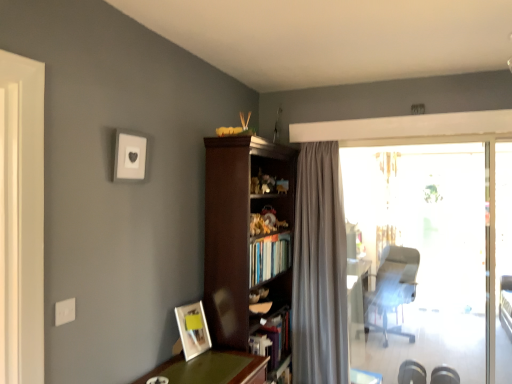
Question: Which is correct: metallic silver chair at right is inside transparent glass door at right, or outside of it?

Choices:
 (A) outside
 (B) inside

Answer: (A)

Question: Is metallic silver chair at right wider or thinner than transparent glass door at right?

Choices:
 (A) thin
 (B) wide

Answer: (B)

Question: Which is nearer to the matte wooden picture frame at lower left, which ranks as the 1th picture frame in right-to-left order?

Choices:
 (A) dark wood bookcase at center
 (B) transparent glass door at right
 (C) hardcover books at center
 (D) metallic silver chair at right
 (E) satin gray curtain at center

Answer: (C)

Question: Which object is positioned closest to the hardcover books at center?

Choices:
 (A) transparent glass door at right
 (B) satin gray curtain at center
 (C) matte wooden picture frame at lower left, the 2th picture frame viewed from the left
 (D) matte gray frame at upper left, the second picture frame viewed from the right
 (E) metallic silver chair at right

Answer: (B)